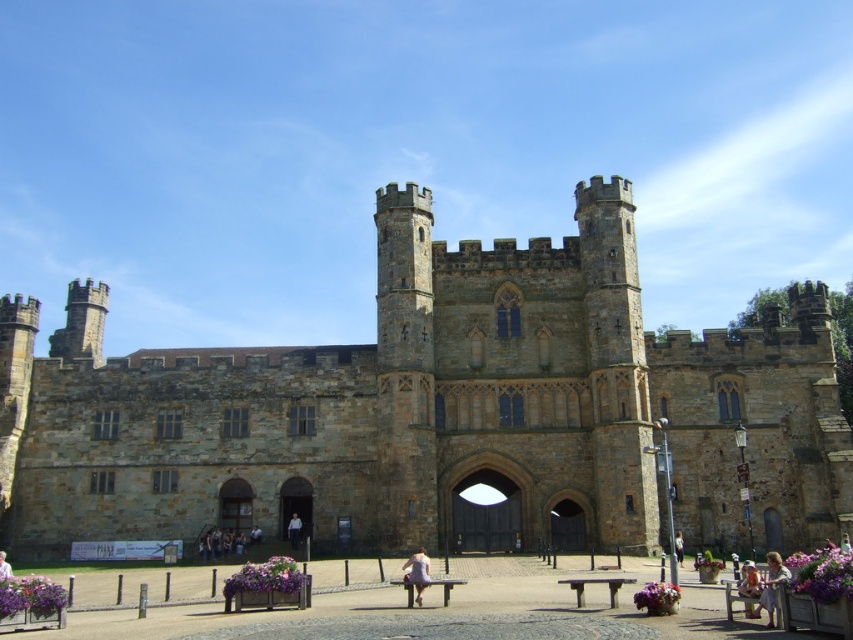
You are a knight standing at the entrance of the brown stone castle at center. You need to move your light brown wooden bench at lower right to the courtyard. Can you move it through the arched gateway without tilting it sideways?

The brown stone castle at center might be wider than light brown wooden bench at lower right, so it is uncertain whether the bench can pass through the gateway without tilting. Check the width of the gateway and the bench before attempting.

You are a visitor standing in the courtyard of the brown stone castle at center. You want to take a photo of the castle with your smartphone. To ensure the entire castle fits in the frame, where should you position yourself relative to the light brown wooden bench at lower right?

Since the brown stone castle at center is taller than the light brown wooden bench at lower right, you should move further away from the light brown wooden bench at lower right to capture the entire height of the castle in your photo.